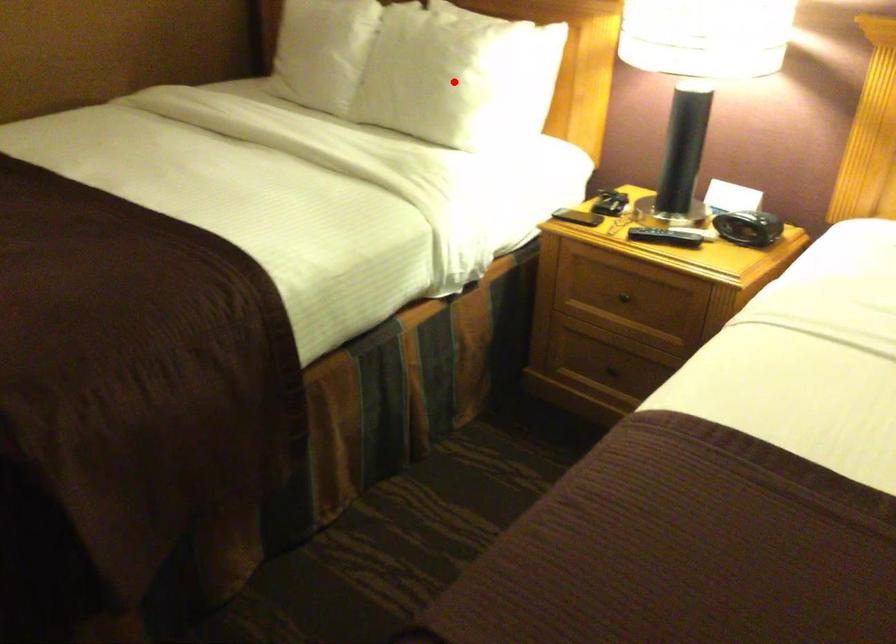
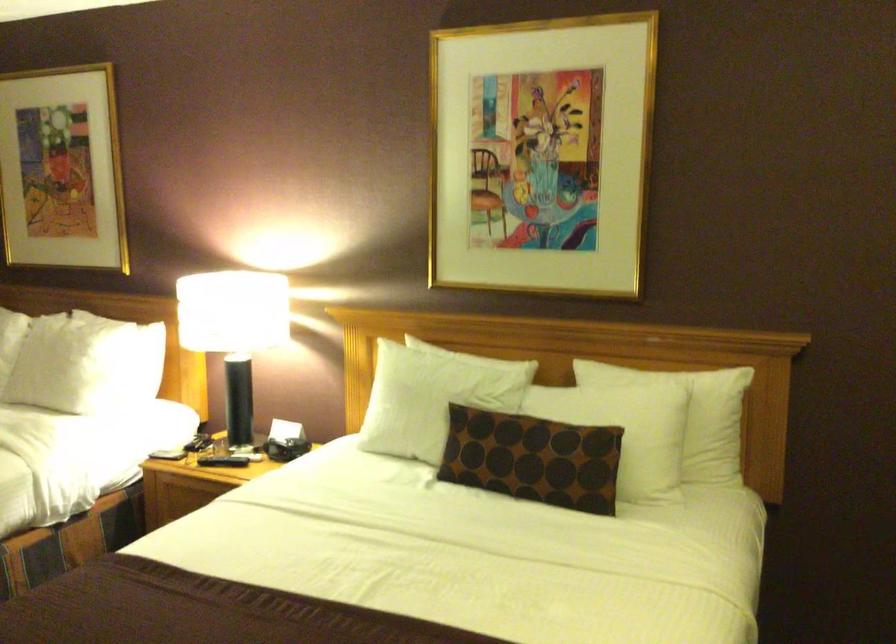
In the second image, find the point that corresponds to the highlighted location in the first image.

(73, 364)